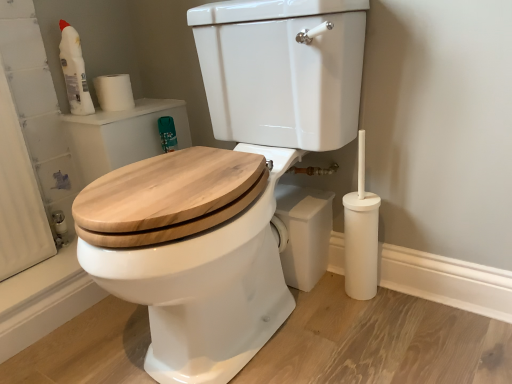
Where is `vacant region to the right of white plastic toilet brush at lower right`? The image size is (512, 384). vacant region to the right of white plastic toilet brush at lower right is located at coordinates (420, 304).